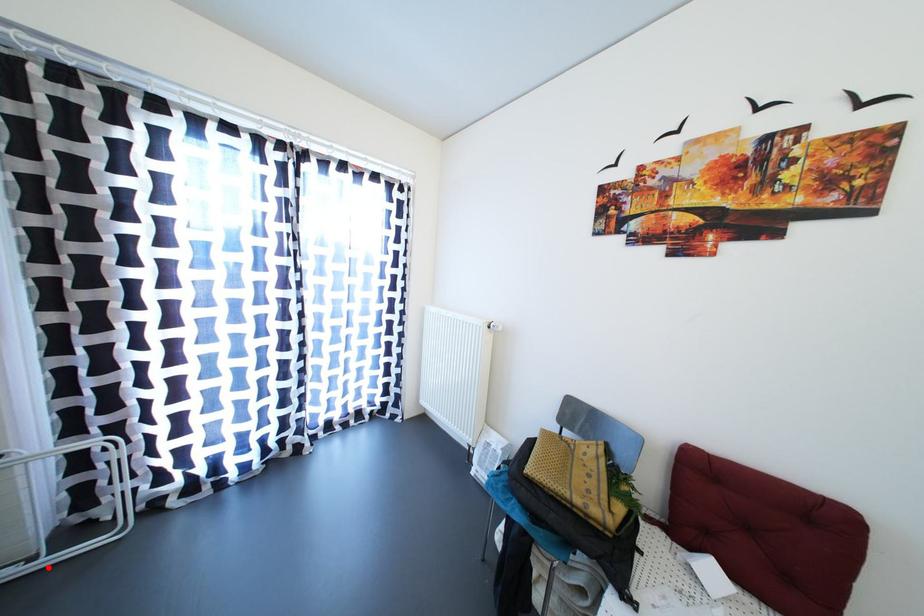
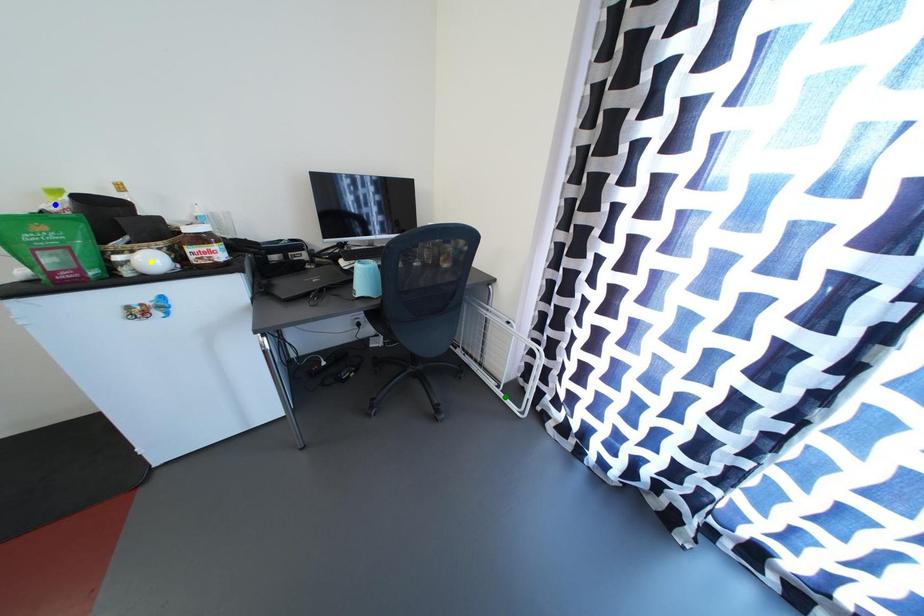
Question: I am providing you with two images of the same scene from different viewpoints. A red point is marked on the first image. You are given multiple points on the second image. Which point in image 2 represents the same 3d spot as the red point in image 1?

Choices:
 (A) green point
 (B) blue point
 (C) yellow point

Answer: (A)